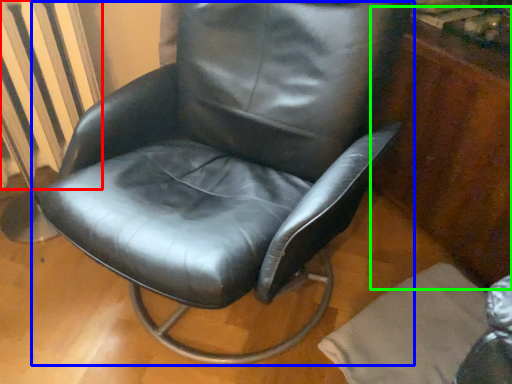
Question: Based on their relative distances, which object is nearer to radiator (highlighted by a red box)? Choose from chair (highlighted by a blue box) and dresser (highlighted by a green box).

Choices:
 (A) chair
 (B) dresser

Answer: (A)